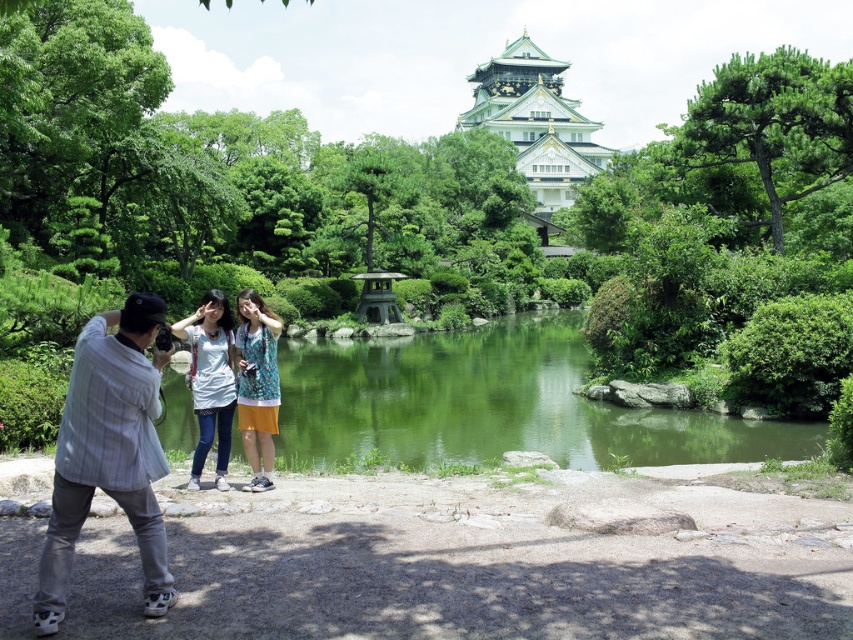
You are standing behind the gray striped shirt at left and the white cotton shirt at center in the scene. Which person is closer to you?

The gray striped shirt at left is closer to you since it is in front of the white cotton shirt at center.

From the picture: You are standing in the scene and want to place a small decorative rock at each of the two points labeled point [76,422] and point [219,413]. Which point is closer to you?

Point [76,422] is closer to the camera than point [219,413], so you should place the decorative rock at point [76,422] first since it is nearer to you.